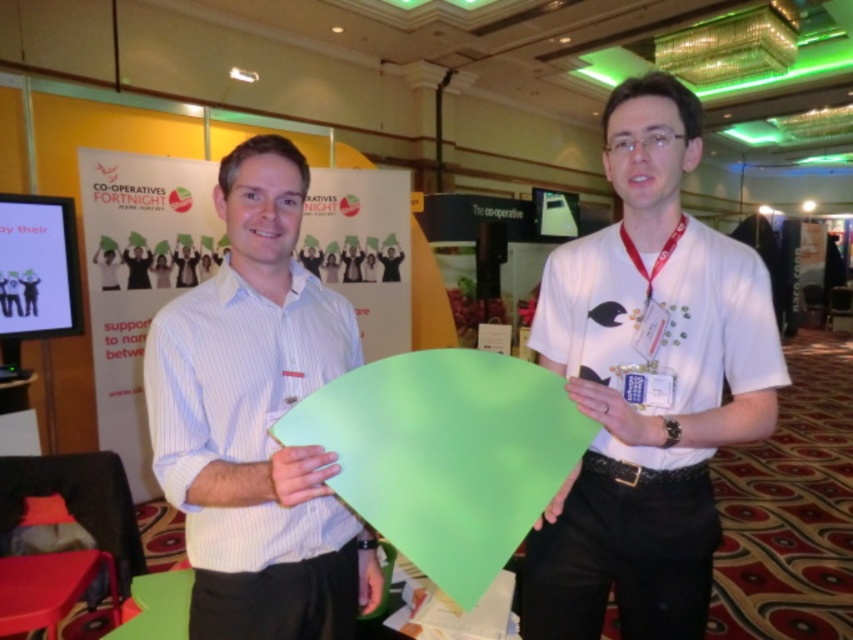
Looking at this image, who is positioned more to the left, white striped shirt at center or white fabric at center?

From the viewer's perspective, white striped shirt at center appears more on the left side.

Who is more forward, (177,486) or (664,240)?

Point (177,486)

Is point (314, 621) farther from viewer compared to point (618, 192)?

No, it is in front of (618, 192).

This screenshot has width=853, height=640. Find the location of `white striped shirt at center`. white striped shirt at center is located at coordinates (257, 426).

Consider the image. Is white matte t-shirt at center thinner than white striped shirt at center?

No.

Is white matte t-shirt at center taller than white striped shirt at center?

Yes, white matte t-shirt at center is taller than white striped shirt at center.

Between point (596, 568) and point (299, 298), which one is positioned behind?

The point (596, 568) is behind.

Image resolution: width=853 pixels, height=640 pixels. Identify the location of white matte t-shirt at center. (646, 424).

Image resolution: width=853 pixels, height=640 pixels. Describe the element at coordinates (646, 424) in the screenshot. I see `white matte t-shirt at center` at that location.

Which is above, white matte t-shirt at center or white matte neck at center?

white matte neck at center is higher up.

Between point (665, 113) and point (254, 259), which one is positioned behind?

The point (665, 113) is behind.

Find the location of `white matte t-shirt at center`. white matte t-shirt at center is located at coordinates (646, 424).